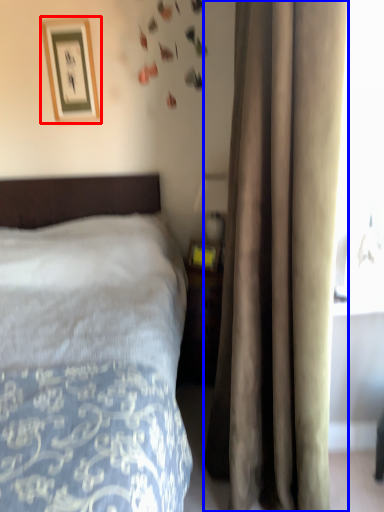
Question: Which point is further to the camera, picture frame (highlighted by a red box) or curtain (highlighted by a blue box)?

Choices:
 (A) picture frame
 (B) curtain

Answer: (A)